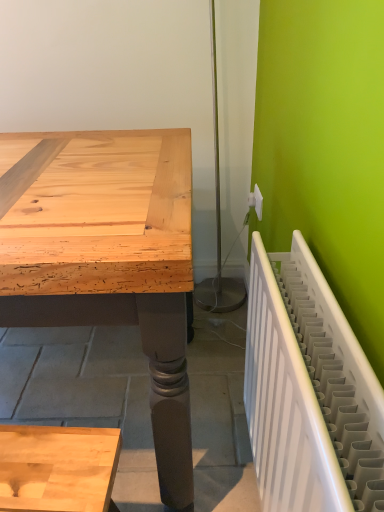
Question: Looking at the image, does white plastic electric outlet at upper right seem bigger or smaller compared to white plastic radiator at right?

Choices:
 (A) small
 (B) big

Answer: (A)

Question: In terms of width, does white plastic electric outlet at upper right look wider or thinner when compared to white plastic radiator at right?

Choices:
 (A) wide
 (B) thin

Answer: (B)

Question: Do you think white plastic electric outlet at upper right is within white plastic radiator at right, or outside of it?

Choices:
 (A) outside
 (B) inside

Answer: (A)

Question: In terms of height, does white plastic radiator at right look taller or shorter compared to white plastic electric outlet at upper right?

Choices:
 (A) tall
 (B) short

Answer: (A)

Question: From a real-world perspective, is white plastic radiator at right physically located above or below white plastic electric outlet at upper right?

Choices:
 (A) above
 (B) below

Answer: (B)

Question: Choose the correct answer: Is white plastic radiator at right inside white plastic electric outlet at upper right or outside it?

Choices:
 (A) outside
 (B) inside

Answer: (A)

Question: In the image, is white plastic radiator at right positioned in front of or behind white plastic electric outlet at upper right?

Choices:
 (A) behind
 (B) front

Answer: (B)